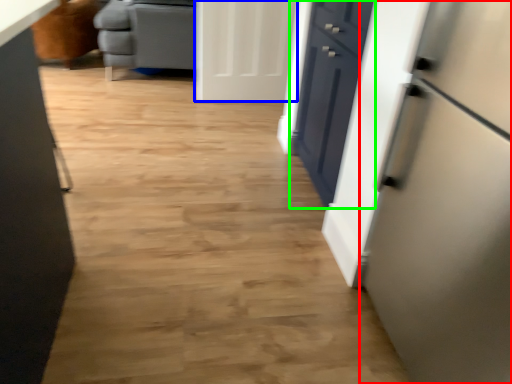
Question: Which object is the closest to the refrigerator (highlighted by a red box)? Choose among these: door (highlighted by a blue box) or drawer (highlighted by a green box).

Choices:
 (A) door
 (B) drawer

Answer: (B)